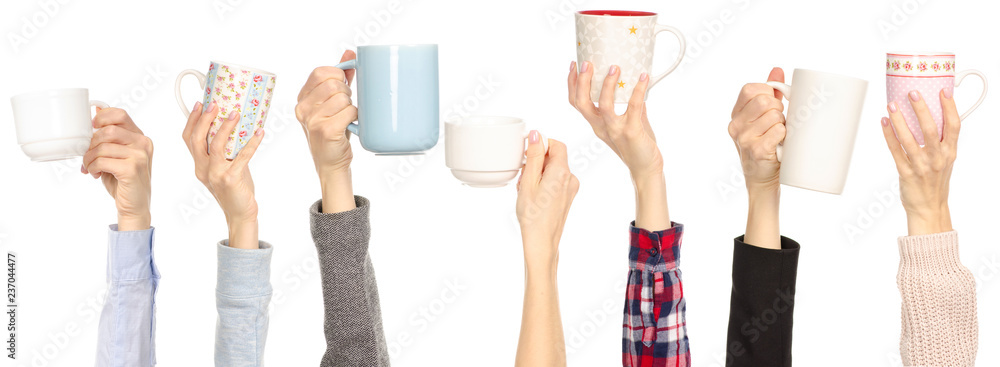
This screenshot has height=367, width=1000. Identify the location of white mug. (608, 49), (819, 108), (492, 143), (60, 106), (248, 89).